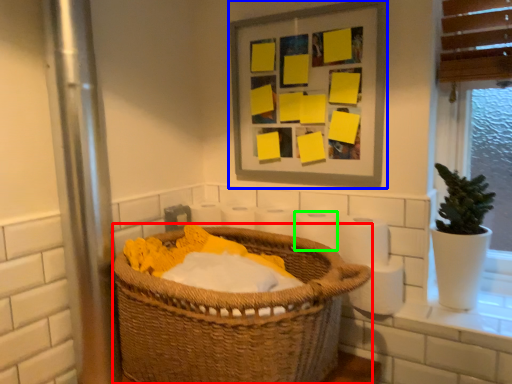
Question: Which object is positioned farthest from basket (highlighted by a red box)? Select from picture frame (highlighted by a blue box) and toilet paper (highlighted by a green box).

Choices:
 (A) picture frame
 (B) toilet paper

Answer: (A)